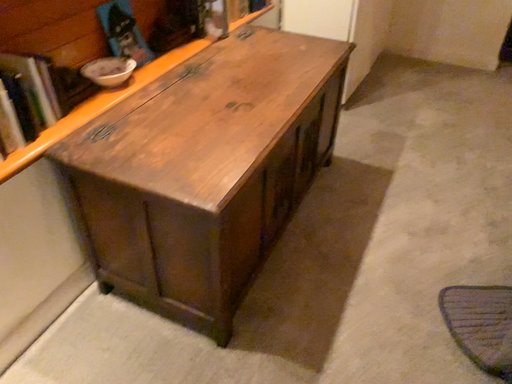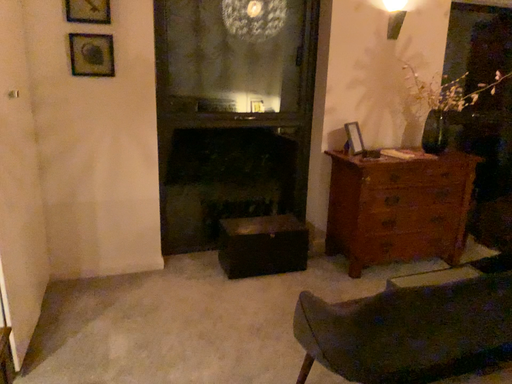
Question: Which way did the camera rotate in the video?

Choices:
 (A) rotated right
 (B) rotated left

Answer: (A)